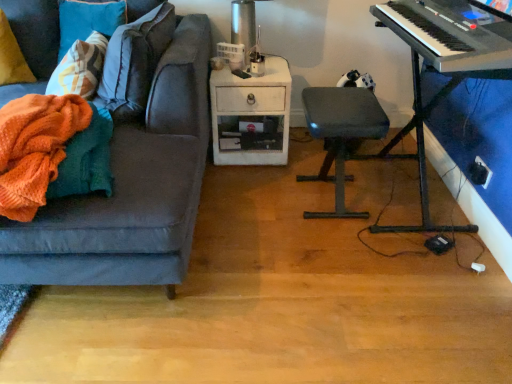
The image size is (512, 384). I want to click on vacant position to the left of matte gray stool at center, so click(252, 202).